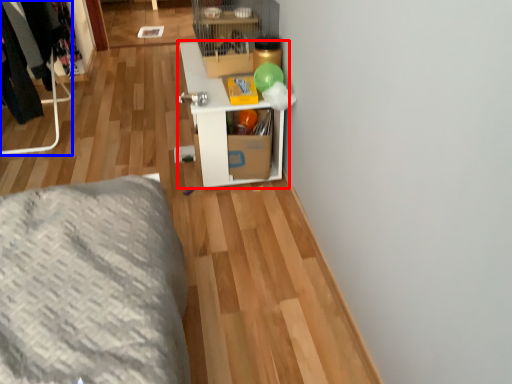
Question: Which of the following is the farthest to the observer, shelf (highlighted by a red box) or furniture (highlighted by a blue box)?

Choices:
 (A) shelf
 (B) furniture

Answer: (B)